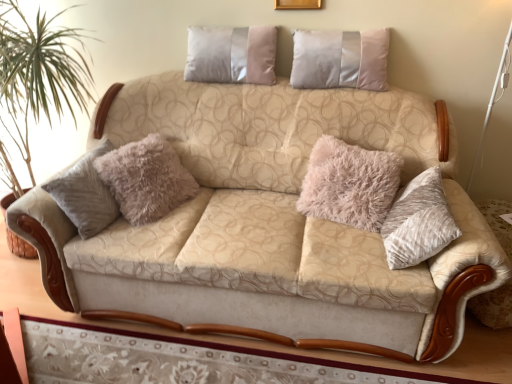
Describe the element at coordinates (297, 4) in the screenshot. I see `wooden picture frame at upper center` at that location.

Find the location of `wooden picture frame at upper center`. wooden picture frame at upper center is located at coordinates (297, 4).

In order to face wooden picture frame at upper center, should I rotate leftwards or rightwards?

Turn right by 5.905 degrees to look at wooden picture frame at upper center.

In the scene shown: Measure the distance between wooden picture frame at upper center and camera.

6.95 feet.

At what (x,y) coordinates should I click in order to perform the action: click on wooden picture frame at upper center. Please return your answer as a coordinate pair (x, y). Looking at the image, I should click on (x=297, y=4).